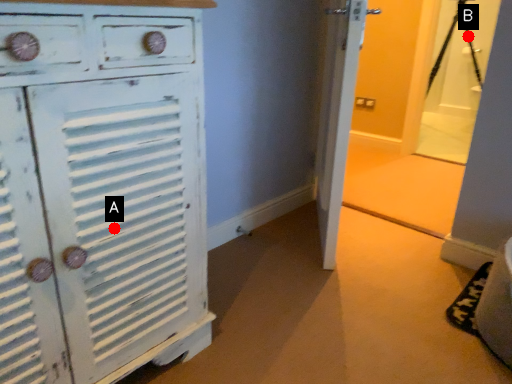
Question: Two points are circled on the image, labeled by A and B beside each circle. Which of the following is the farthest from the observer?

Choices:
 (A) A is further
 (B) B is further

Answer: (B)